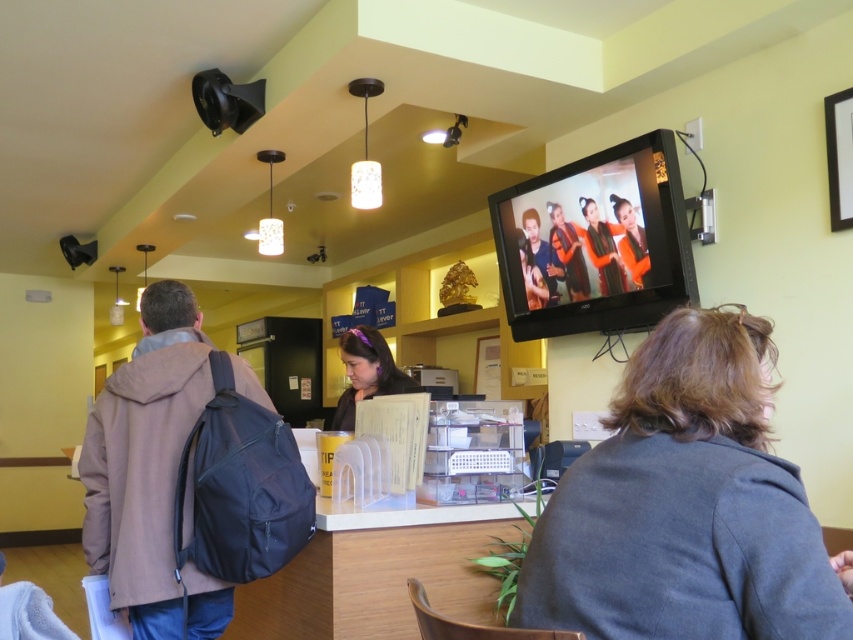
You are a customer at the cafe and need to place your small bag on the counter. The dark gray fabric jacket at lower right and the matte purple hairband at center are already on the counter. Which item should you move to make space for your bag?

You should move the dark gray fabric jacket at lower right because it has a larger width than the matte purple hairband at center, so moving it would free up more space for your bag.

You are a customer in the cafe and want to place your order. You see a dark gray fabric jacket at lower right and a brown fabric backpack at left. Which item is closer to your right side?

The dark gray fabric jacket at lower right is positioned on the right side of the brown fabric backpack at left, so it is closer to your right side.

You are a customer in the cafe and want to place an order. You notice the matte purple hairband at center and the orange fabric woman at upper center. Which object is positioned higher in the image?

The matte purple hairband at center is much taller than the orange fabric woman at upper center, so it is positioned higher in the image.